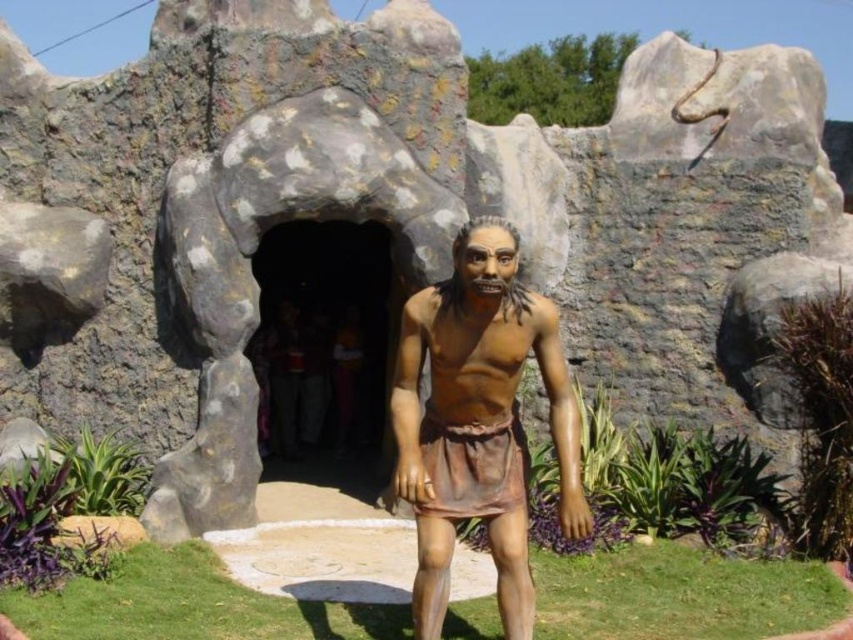
Does brown matte statue at center have a greater height compared to dark stone cave at center?

No, brown matte statue at center is not taller than dark stone cave at center.

Identify the location of brown matte statue at center. (479, 420).